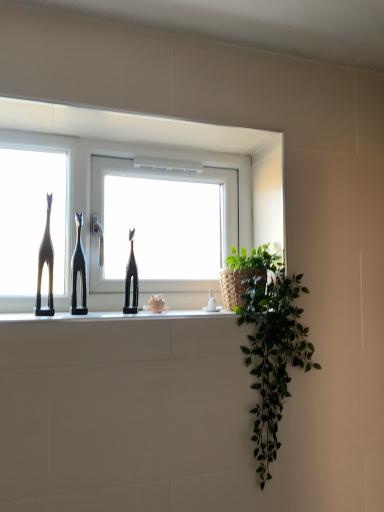
Question: From the image's perspective, does matte black giraffe at left appear higher than black matte cat at center, positioned as the 1th sculpture in left-to-right order?

Choices:
 (A) no
 (B) yes

Answer: (B)

Question: From a real-world perspective, is matte black giraffe at left located beneath black matte cat at center, placed as the 2th sculpture when sorted from right to left?

Choices:
 (A) yes
 (B) no

Answer: (B)

Question: Considering the relative sizes of matte black giraffe at left and black matte cat at center, placed as the 2th sculpture when sorted from right to left, in the image provided, is matte black giraffe at left shorter than black matte cat at center, placed as the 2th sculpture when sorted from right to left,?

Choices:
 (A) no
 (B) yes

Answer: (A)

Question: Does matte black giraffe at left have a smaller size compared to black matte cat at center, positioned as the 1th sculpture in left-to-right order?

Choices:
 (A) yes
 (B) no

Answer: (B)

Question: Does matte black giraffe at left turn towards black matte cat at center, positioned as the 1th sculpture in left-to-right order?

Choices:
 (A) no
 (B) yes

Answer: (A)

Question: Considering the positions of white glossy window at center and black matte cat at center, positioned as the 1th sculpture in left-to-right order, in the image, is white glossy window at center bigger or smaller than black matte cat at center, positioned as the 1th sculpture in left-to-right order,?

Choices:
 (A) small
 (B) big

Answer: (B)

Question: From the image's perspective, is white glossy window at center above or below black matte cat at center, placed as the 2th sculpture when sorted from right to left?

Choices:
 (A) below
 (B) above

Answer: (B)

Question: Would you say white glossy window at center is inside or outside black matte cat at center, positioned as the 1th sculpture in left-to-right order?

Choices:
 (A) outside
 (B) inside

Answer: (A)

Question: Considering the positions of white glossy window at center and black matte cat at center, placed as the 2th sculpture when sorted from right to left, in the image, is white glossy window at center wider or thinner than black matte cat at center, placed as the 2th sculpture when sorted from right to left,?

Choices:
 (A) thin
 (B) wide

Answer: (B)

Question: In terms of width, does black glossy giraffe at center, marked as the first sculpture in a right-to-left arrangement, look wider or thinner when compared to black matte cat at center, positioned as the 1th sculpture in left-to-right order?

Choices:
 (A) wide
 (B) thin

Answer: (B)

Question: Is black glossy giraffe at center, which appears as the 2th sculpture when viewed from the left, spatially inside black matte cat at center, placed as the 2th sculpture when sorted from right to left, or outside of it?

Choices:
 (A) outside
 (B) inside

Answer: (A)

Question: Looking at the image, does black glossy giraffe at center, which appears as the 2th sculpture when viewed from the left, seem bigger or smaller compared to black matte cat at center, placed as the 2th sculpture when sorted from right to left?

Choices:
 (A) small
 (B) big

Answer: (A)

Question: From the image's perspective, relative to black matte cat at center, positioned as the 1th sculpture in left-to-right order, is black glossy giraffe at center, marked as the first sculpture in a right-to-left arrangement, above or below?

Choices:
 (A) above
 (B) below

Answer: (B)

Question: Considering the positions of white glossy window at center and black glossy giraffe at center, marked as the first sculpture in a right-to-left arrangement, in the image, is white glossy window at center wider or thinner than black glossy giraffe at center, marked as the first sculpture in a right-to-left arrangement,?

Choices:
 (A) wide
 (B) thin

Answer: (A)

Question: Is point (104, 256) positioned closer to the camera than point (132, 250)?

Choices:
 (A) closer
 (B) farther

Answer: (A)